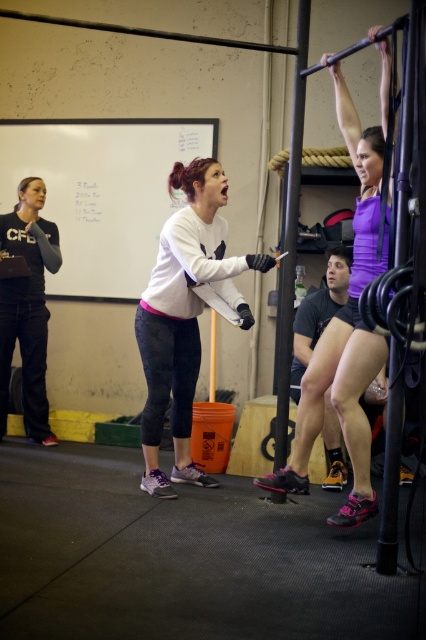
Based on the photo, looking at the white matte sweatshirt at center and the purple matte tank top at upper center, which one is positioned to the left?

The white matte sweatshirt at center is positioned to the left of the purple matte tank top at upper center.

You are a fitness instructor trying to adjust the layout of the gym. The black matte sweatshirt at left and the matte black shorts at center are placed on a rack. Which item should you move to make more space for new equipment?

The black matte sweatshirt at left might be wider than the matte black shorts at center, so moving the black matte sweatshirt at left would free up more space.